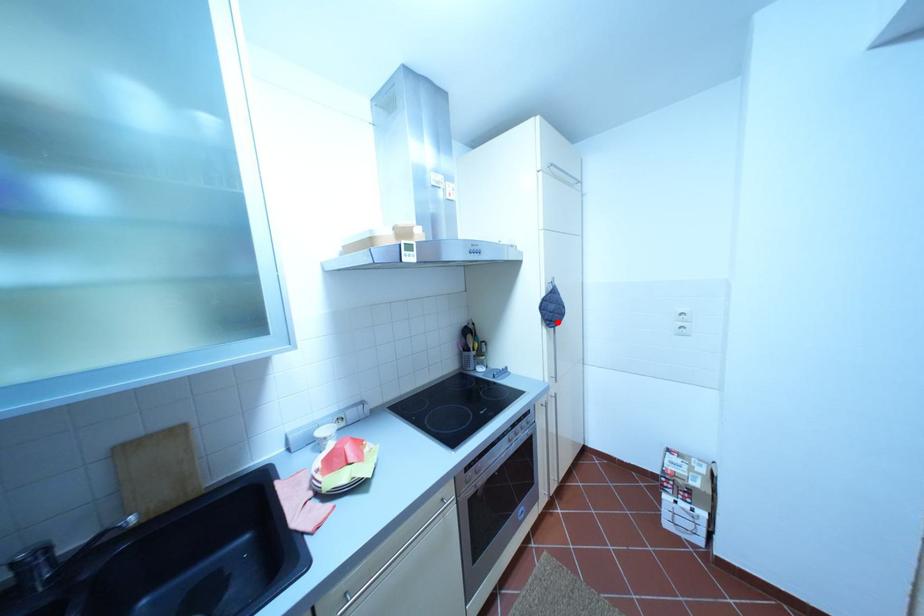
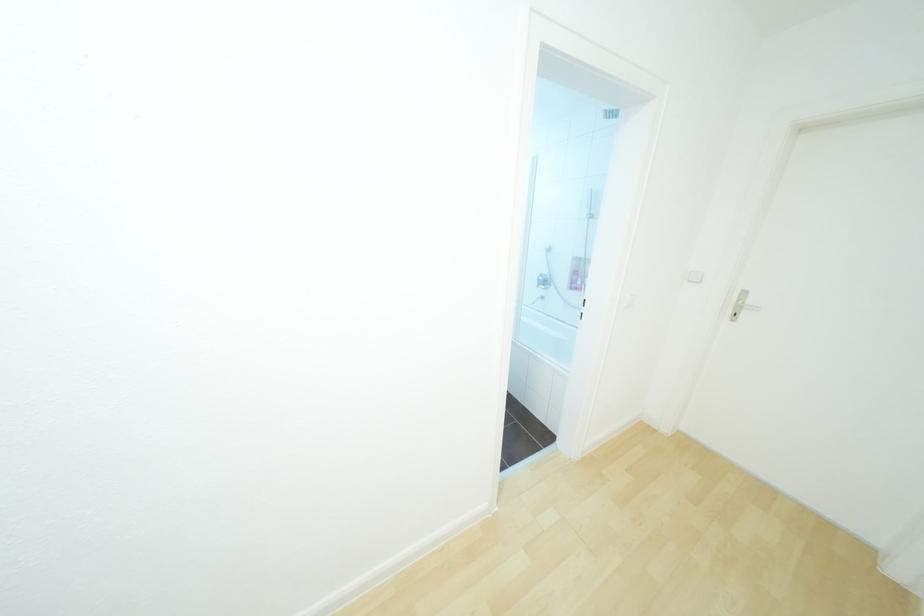
Question: I am providing you with two images of the same scene from different viewpoints. A red point is marked on the first image. At the location where the point appears in image 1, is it still visible in image 2?

Choices:
 (A) Yes
 (B) No

Answer: (B)